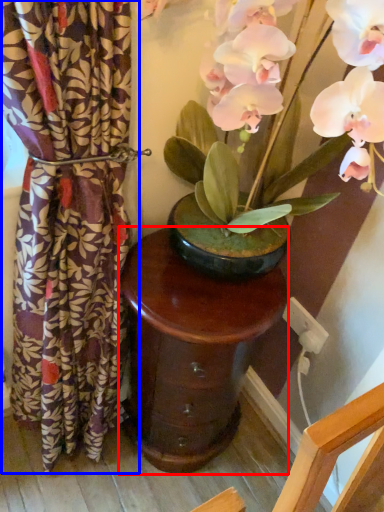
Question: Which object is closer to the camera taking this photo, table (highlighted by a red box) or curtain (highlighted by a blue box)?

Choices:
 (A) table
 (B) curtain

Answer: (B)